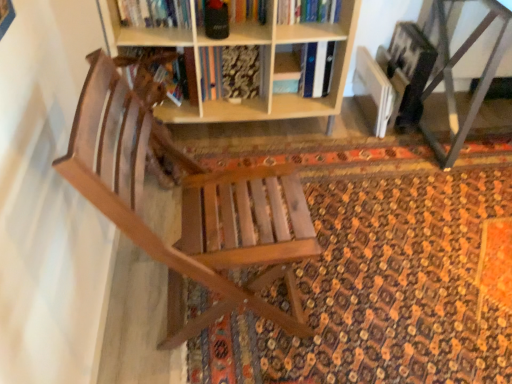
Question: In the image, is patterned carpet at center positioned in front of or behind metallic gray table at lower right?

Choices:
 (A) behind
 (B) front

Answer: (B)

Question: Is patterned carpet at center wider or thinner than metallic gray table at lower right?

Choices:
 (A) thin
 (B) wide

Answer: (B)

Question: Estimate the real-world distances between objects in this image. Which object is farther from the hardcover book at upper center?

Choices:
 (A) metallic gray table at lower right
 (B) wooden bookshelf at upper center
 (C) patterned carpet at center
 (D) wooden chair at center

Answer: (D)

Question: Which object is the farthest from the wooden chair at center?

Choices:
 (A) metallic gray table at lower right
 (B) wooden bookshelf at upper center
 (C) hardcover book at upper center
 (D) patterned carpet at center

Answer: (A)